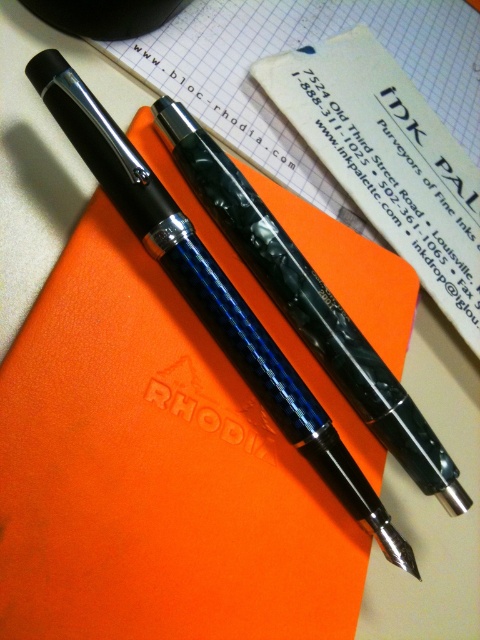
You are trying to determine the best position to place a new pen holder between the two points, point (311, 397) and point (222, 221), so that it is as close as possible to the viewer. Which point should you choose?

You should choose point (311, 397) because it is closer to the viewer than point (222, 221).